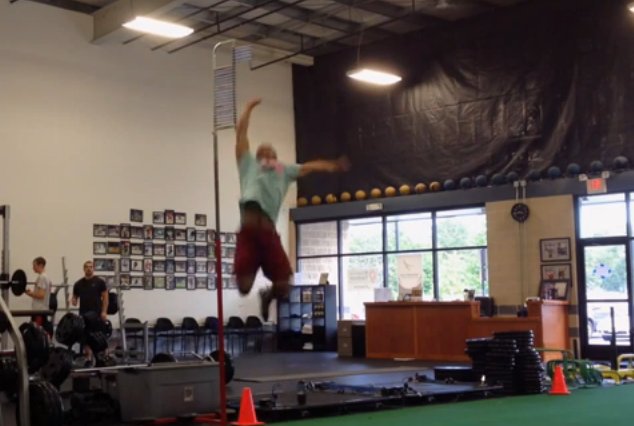
Find the location of `black flag or tarp of some sort, covering a whole part of the wall`. black flag or tarp of some sort, covering a whole part of the wall is located at coordinates (521, 105).